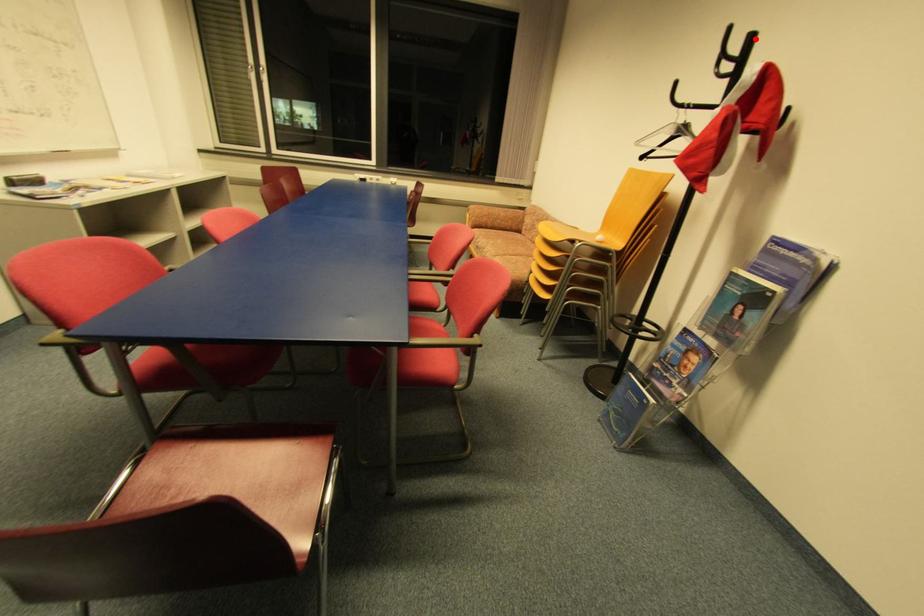
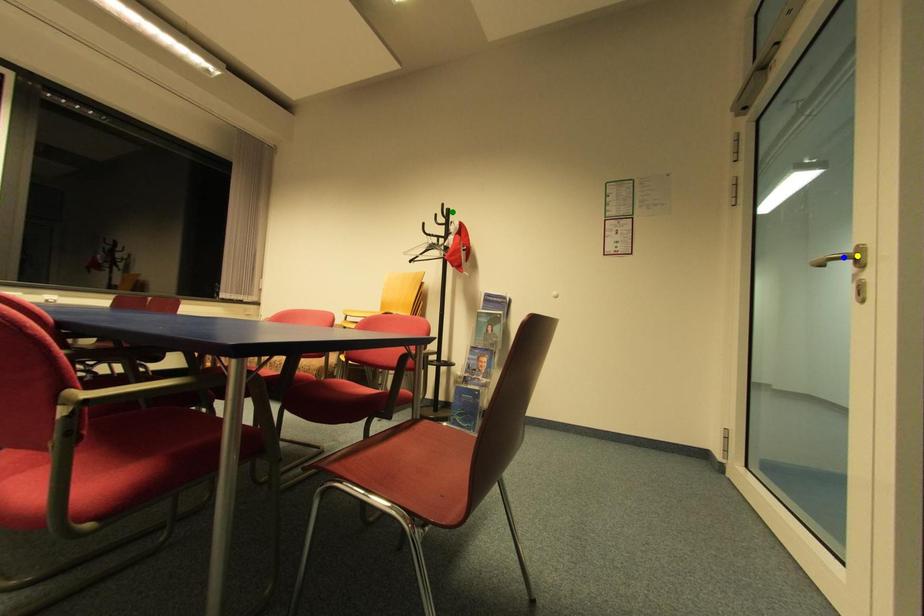
Question: I am providing you with two images of the same scene from different viewpoints. A red point is marked on the first image. You are given multiple points on the second image. Can you choose the point in image 2 that corresponds to the point in image 1?

Choices:
 (A) blue point
 (B) green point
 (C) yellow point

Answer: (B)